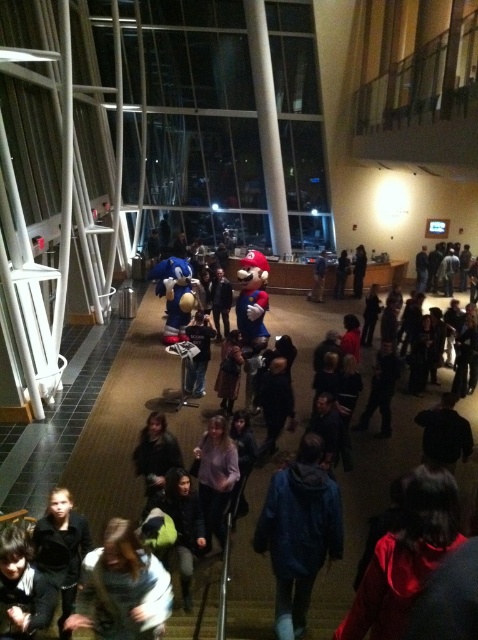
Is dark red fabric at lower right smaller than light brown hair at center?

Correct, dark red fabric at lower right occupies less space than light brown hair at center.

From the picture: Does dark red fabric at lower right have a larger size compared to light brown hair at center?

Incorrect, dark red fabric at lower right is not larger than light brown hair at center.

The height and width of the screenshot is (640, 478). I want to click on dark red fabric at lower right, so click(405, 556).

Where is `dark red fabric at lower right`? dark red fabric at lower right is located at coordinates (405, 556).

Is blue fuzzy jacket at lower center smaller than blue plush toy at center?

Correct, blue fuzzy jacket at lower center occupies less space than blue plush toy at center.

In the scene shown: Is blue fuzzy jacket at lower center above blue plush toy at center?

Incorrect, blue fuzzy jacket at lower center is not positioned above blue plush toy at center.

What do you see at coordinates (299, 532) in the screenshot? I see `blue fuzzy jacket at lower center` at bounding box center [299, 532].

You are a GUI agent. You are given a task and a screenshot of the screen. Output one action in this format:
    pyautogui.click(x=<x>, y=<y>)
    Task: Click on the blue fuzzy jacket at lower center
    Image resolution: width=478 pixels, height=640 pixels.
    Given the screenshot: What is the action you would take?
    pyautogui.click(x=299, y=532)

Between dark blue hoodie at lower left and blue plush toy at center, which one has more height?

With more height is blue plush toy at center.

Does dark blue hoodie at lower left appear under blue plush toy at center?

Yes.

Does point (10, 632) come closer to viewer compared to point (227, 282)?

Yes, it is.

This screenshot has height=640, width=478. What are the coordinates of `dark blue hoodie at lower left` in the screenshot? It's located at (21, 588).